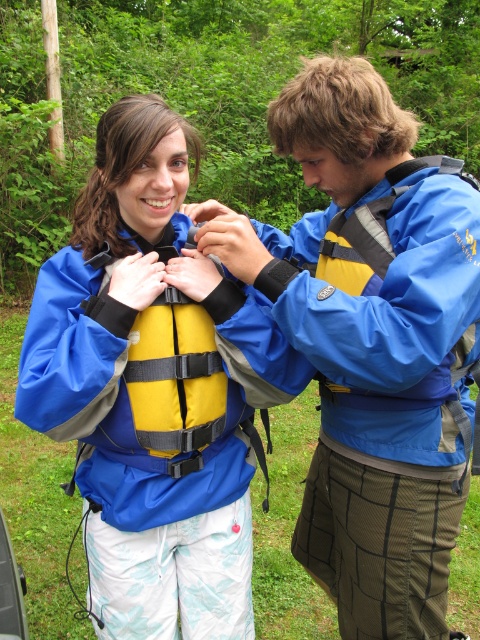
Question: Where is blue waterproof jacket at center located in relation to matte blue jacket at center in the image?

Choices:
 (A) right
 (B) left

Answer: (A)

Question: Can you confirm if blue waterproof jacket at center is thinner than matte blue jacket at center?

Choices:
 (A) yes
 (B) no

Answer: (A)

Question: Among these objects, which one is farthest from the camera?

Choices:
 (A) matte blue jacket at center
 (B) blue waterproof jacket at center

Answer: (A)

Question: Which object appears closest to the camera in this image?

Choices:
 (A) blue waterproof jacket at center
 (B) matte blue jacket at center

Answer: (A)

Question: Can you confirm if blue waterproof jacket at center is positioned above matte blue jacket at center?

Choices:
 (A) yes
 (B) no

Answer: (A)